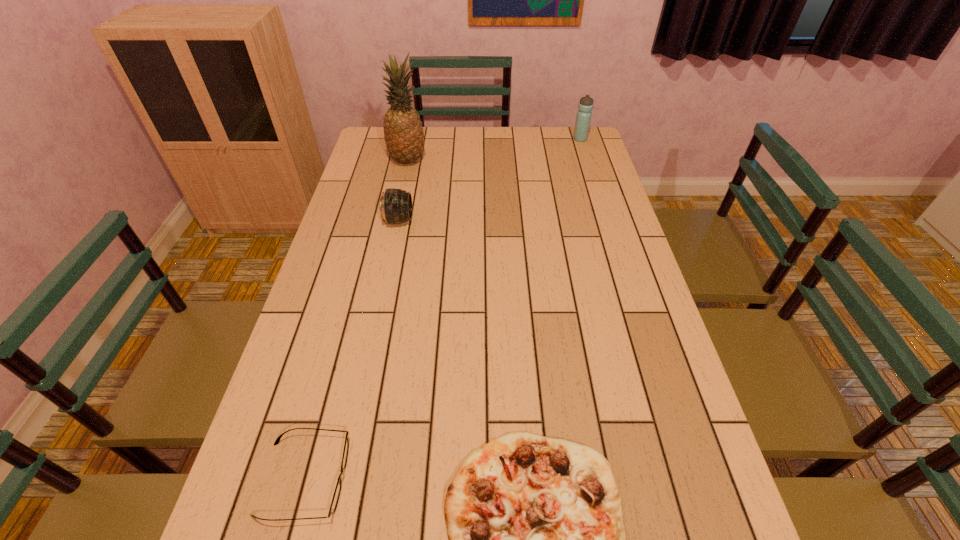
Find the location of `vacant space located on the front-facing side of the spectacles`. vacant space located on the front-facing side of the spectacles is located at coordinates (472, 478).

Locate an element on the screen. This screenshot has width=960, height=540. pineapple located in the far edge section of the desktop is located at coordinates (403, 132).

The image size is (960, 540). Find the location of `water bottle present at the far edge`. water bottle present at the far edge is located at coordinates (583, 119).

Where is `pineapple that is positioned at the left edge`? pineapple that is positioned at the left edge is located at coordinates click(403, 132).

Locate an element on the screen. telephoto lens that is at the left edge is located at coordinates (395, 205).

Where is `spectacles present at the left edge`? spectacles present at the left edge is located at coordinates (335, 499).

At what (x,y) coordinates should I click in order to perform the action: click on object positioned at the right edge. Please return your answer as a coordinate pair (x, y). Looking at the image, I should click on (583, 119).

Identify the location of object present at the far left corner. The image size is (960, 540). (403, 132).

This screenshot has height=540, width=960. Find the location of `object situated at the far right corner`. object situated at the far right corner is located at coordinates (583, 119).

I want to click on free space at the far edge of the desktop, so click(x=472, y=134).